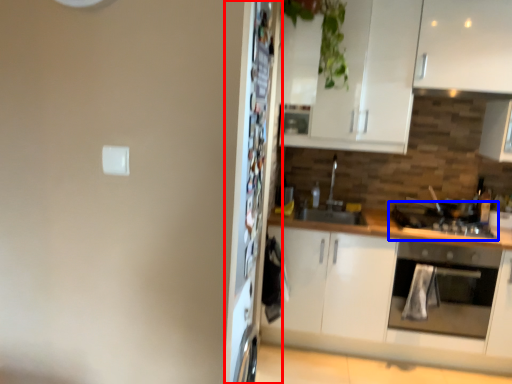
Question: Which object is closer to the camera taking this photo, fridge (highlighted by a red box) or gas stove (highlighted by a blue box)?

Choices:
 (A) fridge
 (B) gas stove

Answer: (A)